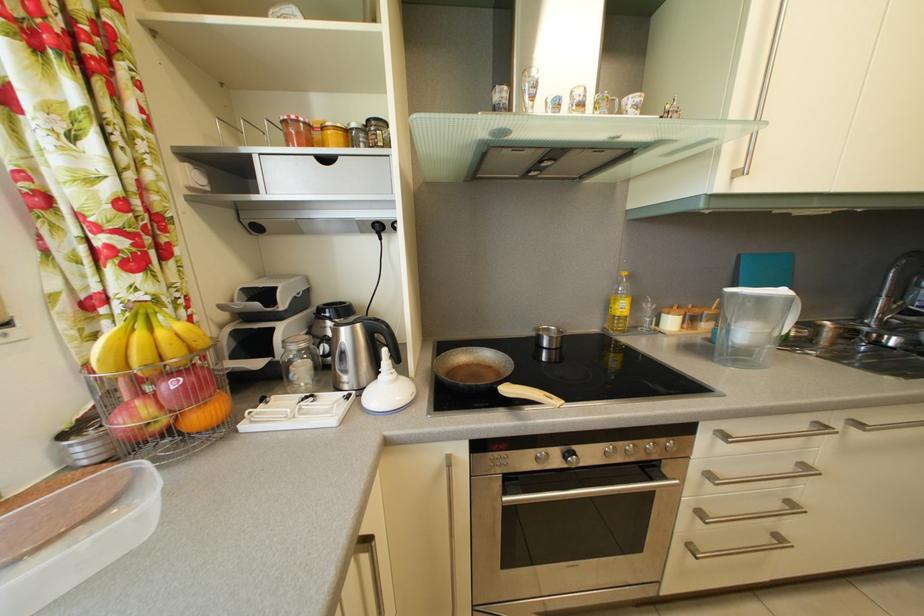
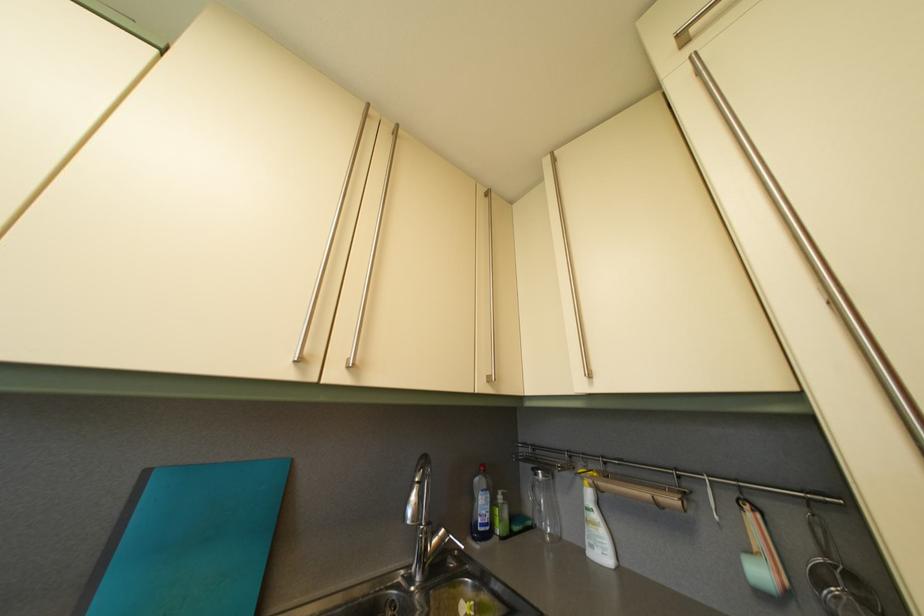
In the second image, find the point that corresponds to point (747, 264) in the first image.

(154, 480)